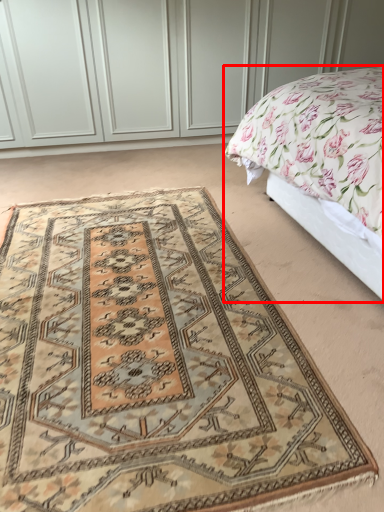
Question: In this image, where is bed (annotated by the red box) located relative to mat?

Choices:
 (A) right
 (B) left

Answer: (A)